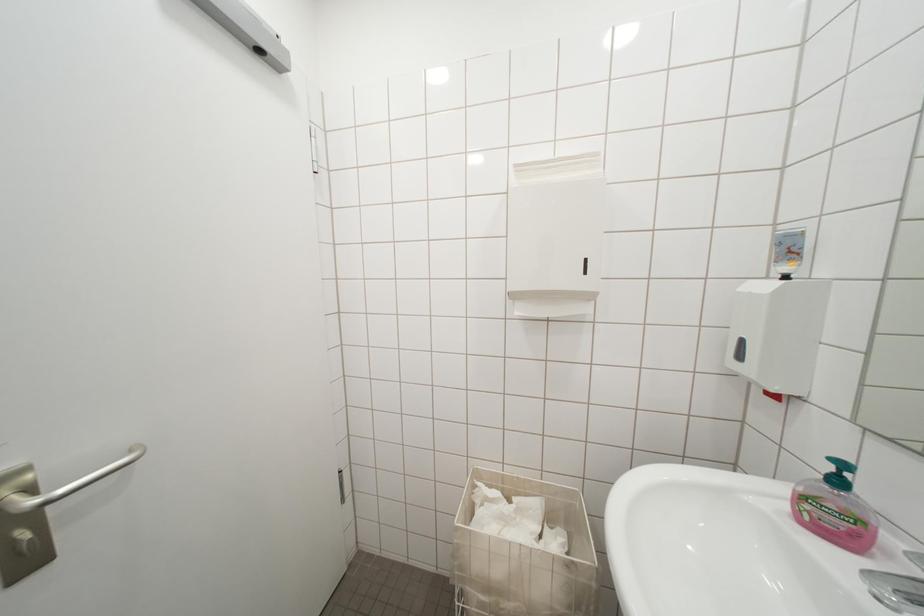
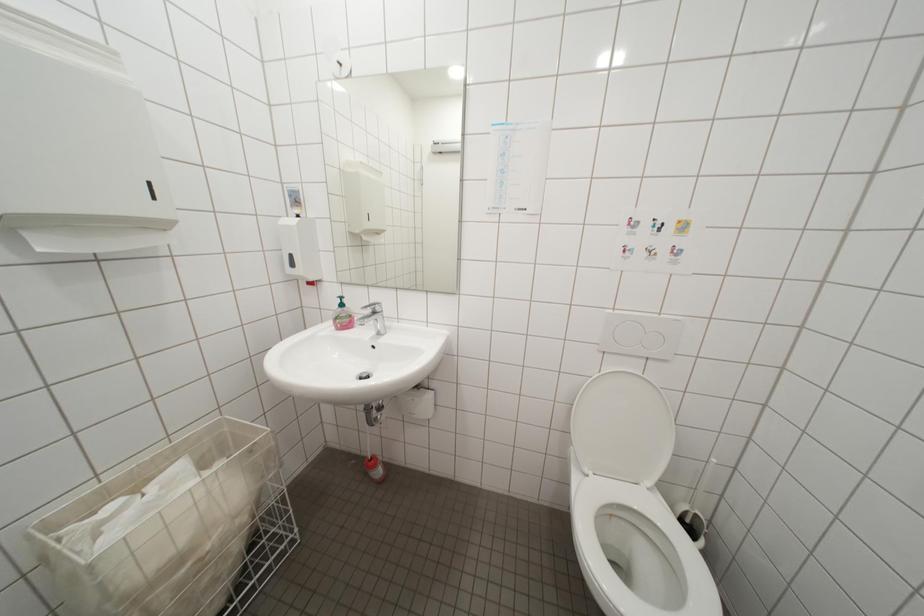
First-person continuous shooting, in which direction is the camera rotating?

The camera's rotation is toward right-down.